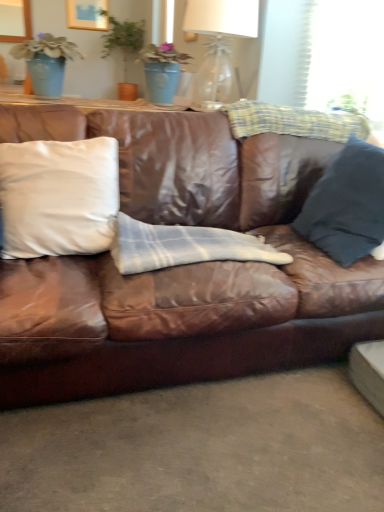
Question: Is brown leather couch at center facing away from white matte pillow at left, which is the 1th pillow from left to right?

Choices:
 (A) no
 (B) yes

Answer: (B)

Question: Is brown leather couch at center positioned before white matte pillow at left, which is the 1th pillow from left to right?

Choices:
 (A) no
 (B) yes

Answer: (B)

Question: Is brown leather couch at center positioned far away from white matte pillow at left, which appears as the 2th pillow when viewed from the right?

Choices:
 (A) yes
 (B) no

Answer: (B)

Question: From a real-world perspective, is brown leather couch at center below white matte pillow at left, which is the 1th pillow from left to right?

Choices:
 (A) no
 (B) yes

Answer: (B)

Question: Does brown leather couch at center lie behind white matte pillow at left, which appears as the 2th pillow when viewed from the right?

Choices:
 (A) no
 (B) yes

Answer: (A)

Question: Is matte blue pot at upper left in front of or behind dark blue fabric pillow at right, the first pillow in the right-to-left sequence, in the image?

Choices:
 (A) front
 (B) behind

Answer: (B)

Question: In terms of height, does matte blue pot at upper left look taller or shorter compared to dark blue fabric pillow at right, the first pillow in the right-to-left sequence?

Choices:
 (A) tall
 (B) short

Answer: (B)

Question: Visually, is matte blue pot at upper left positioned to the left or to the right of dark blue fabric pillow at right, which is the second pillow in left-to-right order?

Choices:
 (A) right
 (B) left

Answer: (B)

Question: Would you say matte blue pot at upper left is inside or outside dark blue fabric pillow at right, the first pillow in the right-to-left sequence?

Choices:
 (A) outside
 (B) inside

Answer: (A)

Question: Based on their sizes in the image, would you say brown leather couch at center is bigger or smaller than dark blue fabric pillow at right, which is the second pillow in left-to-right order?

Choices:
 (A) big
 (B) small

Answer: (A)

Question: Considering the relative positions of brown leather couch at center and dark blue fabric pillow at right, which is the second pillow in left-to-right order, in the image provided, is brown leather couch at center to the left or to the right of dark blue fabric pillow at right, which is the second pillow in left-to-right order,?

Choices:
 (A) right
 (B) left

Answer: (B)

Question: From a real-world perspective, is brown leather couch at center physically located above or below dark blue fabric pillow at right, which is the second pillow in left-to-right order?

Choices:
 (A) above
 (B) below

Answer: (B)

Question: Is point (38, 333) closer or farther from the camera than point (344, 188)?

Choices:
 (A) farther
 (B) closer

Answer: (B)

Question: In terms of size, does white plaid blanket at center appear bigger or smaller than white matte pillow at left, which appears as the 2th pillow when viewed from the right?

Choices:
 (A) small
 (B) big

Answer: (A)

Question: Is white plaid blanket at center situated inside white matte pillow at left, which appears as the 2th pillow when viewed from the right, or outside?

Choices:
 (A) outside
 (B) inside

Answer: (A)